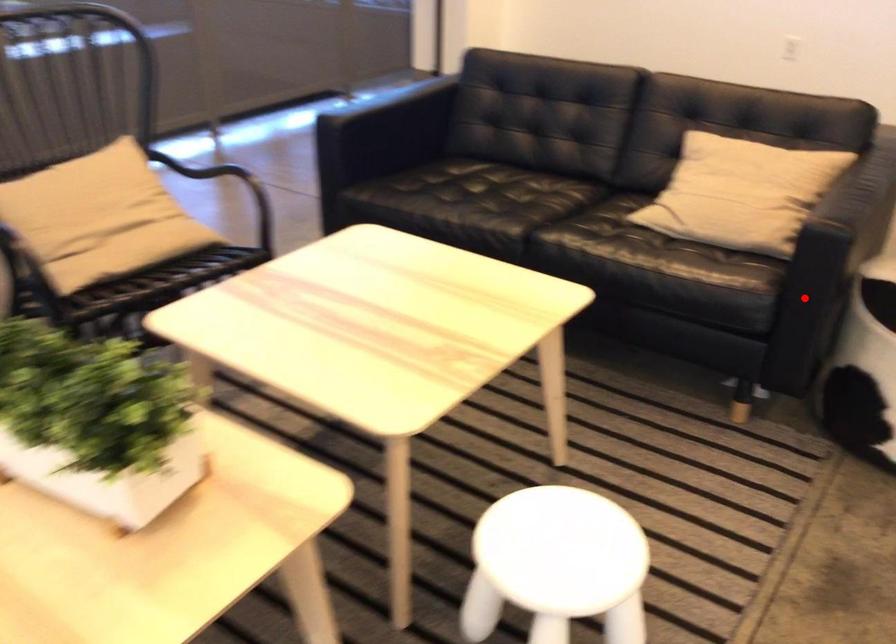
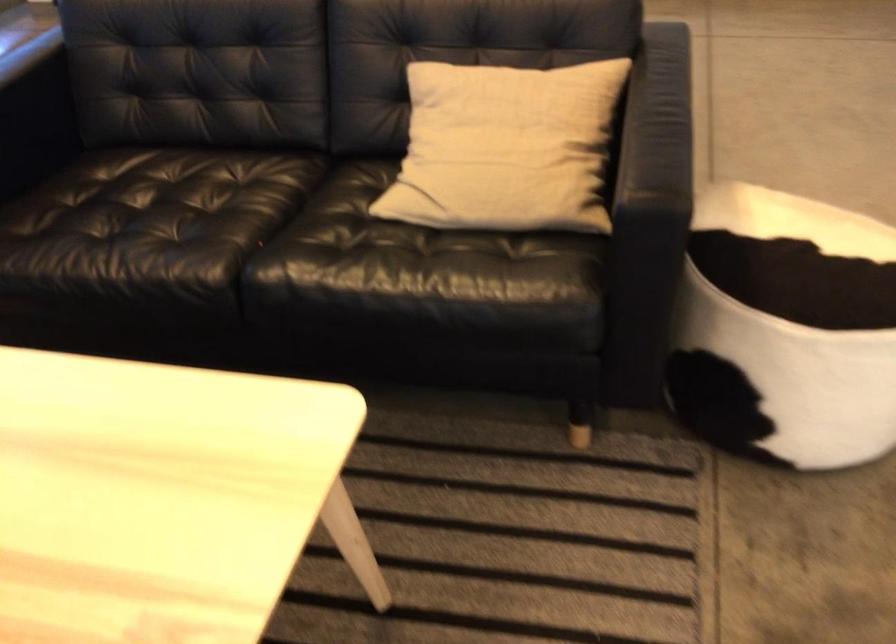
Question: I am providing you with two images of the same scene from different viewpoints. Given a red point in image1, look at the same physical point in image2. Is it:

Choices:
 (A) Closer to the viewpoint
 (B) Farther from the viewpoint

Answer: (A)